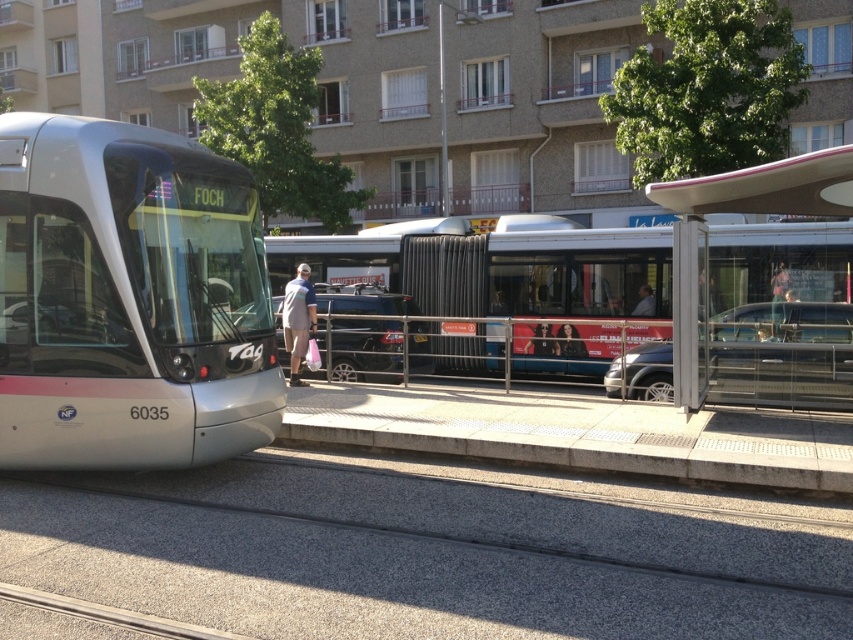
Measure the distance between silver metallic tram at left and camera.

silver metallic tram at left and camera are 6.56 meters apart from each other.

Which is more to the right, silver metallic tram at left or dark brown hair at center?

Result: Positioned to the right is dark brown hair at center.

You are a GUI agent. You are given a task and a screenshot of the screen. Output one action in this format:
    pyautogui.click(x=<x>, y=<y>)
    Task: Click on the silver metallic tram at left
    This screenshot has height=640, width=853.
    Given the screenshot: What is the action you would take?
    pyautogui.click(x=128, y=300)

What do you see at coordinates (299, 320) in the screenshot?
I see `gray fabric bag at center` at bounding box center [299, 320].

Identify the location of gray fabric bag at center. (x=299, y=320).

Locate an element on the screen. gray fabric bag at center is located at coordinates (299, 320).

Can you confirm if dark brown hair at center is thinner than light brown leather jacket at center?

Incorrect, dark brown hair at center's width is not less than light brown leather jacket at center's.

Looking at this image, can you confirm if dark brown hair at center is positioned to the right of light brown leather jacket at center?

Incorrect, dark brown hair at center is not on the right side of light brown leather jacket at center.

Between point (569, 337) and point (647, 308), which one is positioned in front?

Positioned in front is point (647, 308).

What are the coordinates of `dark brown hair at center` in the screenshot? It's located at (570, 342).